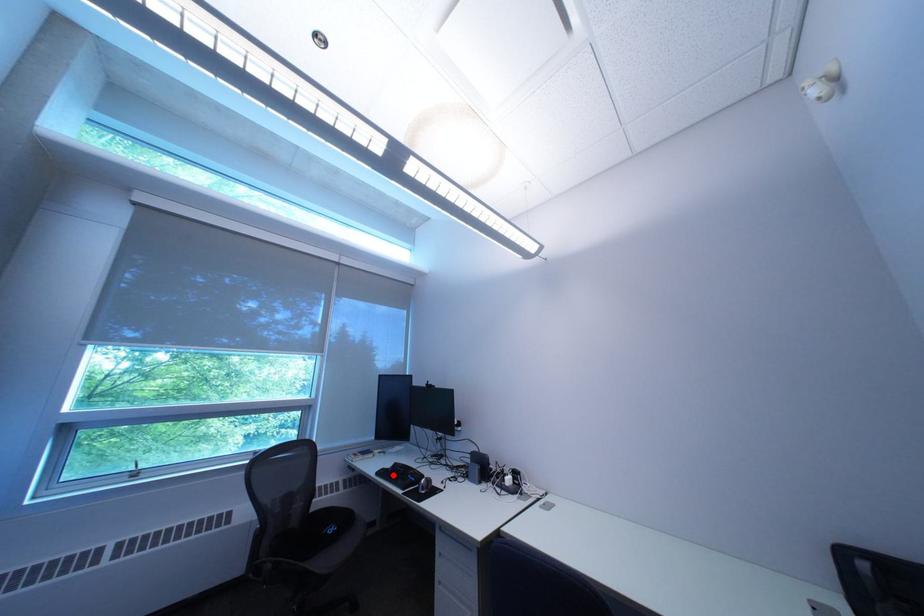
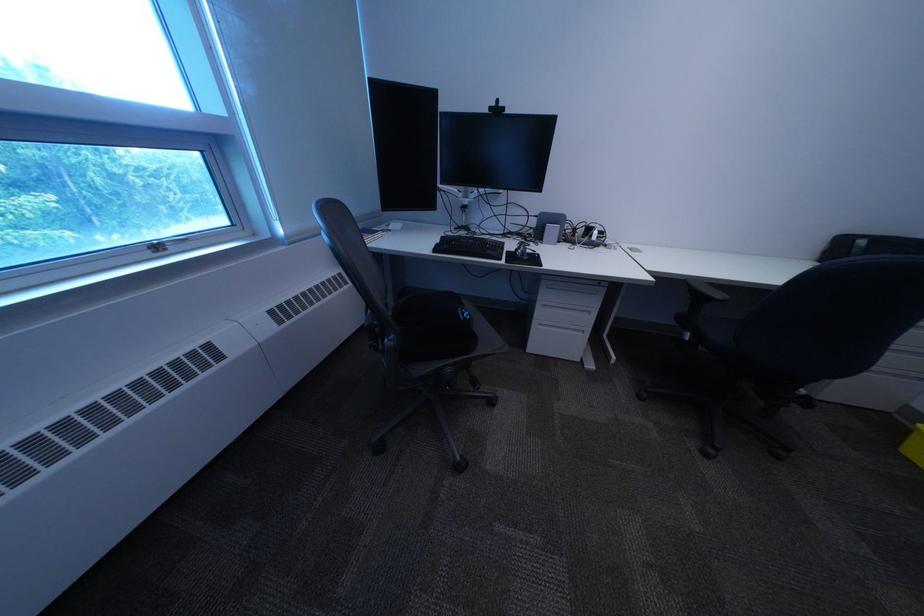
In the second image, find the point that corresponds to the highlighted location in the first image.

(451, 252)